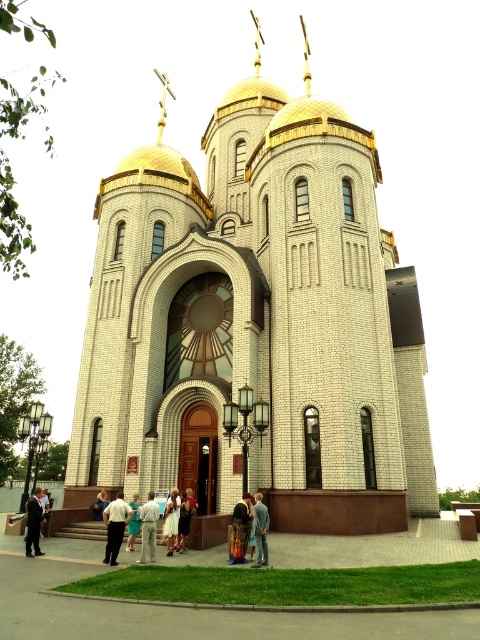
Question: Where is dark gray fabric jacket at center located in relation to light blue dress at center in the image?

Choices:
 (A) left
 (B) right

Answer: (B)

Question: Does dark gray fabric jacket at center have a greater width compared to dark suit at lower left?

Choices:
 (A) yes
 (B) no

Answer: (B)

Question: Which of these objects is positioned closest to the dark gray fabric jacket at center?

Choices:
 (A) white cotton shirt at center
 (B) light blue dress at center
 (C) light beige pants at center

Answer: (C)

Question: Is white brick church at center below dark gray fabric jacket at center?

Choices:
 (A) yes
 (B) no

Answer: (B)

Question: Based on their relative distances, which object is nearer to the light brown leather jacket at lower center?

Choices:
 (A) dark suit at lower left
 (B) light brown fabric dress at lower center
 (C) white brick church at center

Answer: (B)

Question: Which object is the farthest from the light beige pants at center?

Choices:
 (A) light blue dress at center
 (B) light brown fabric dress at lower center
 (C) white brick church at center
 (D) dark gray fabric jacket at center

Answer: (C)